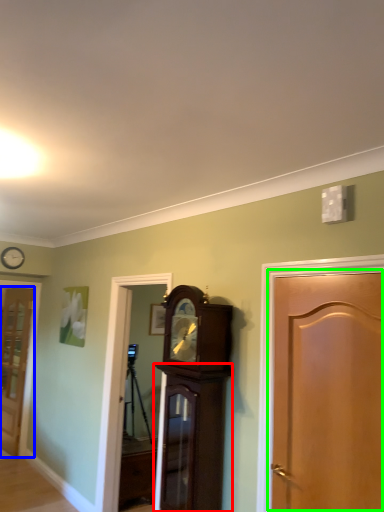
Question: Which object is positioned closest to cabinetry (highlighted by a red box)? Select from door (highlighted by a blue box) and door (highlighted by a green box).

Choices:
 (A) door
 (B) door

Answer: (B)